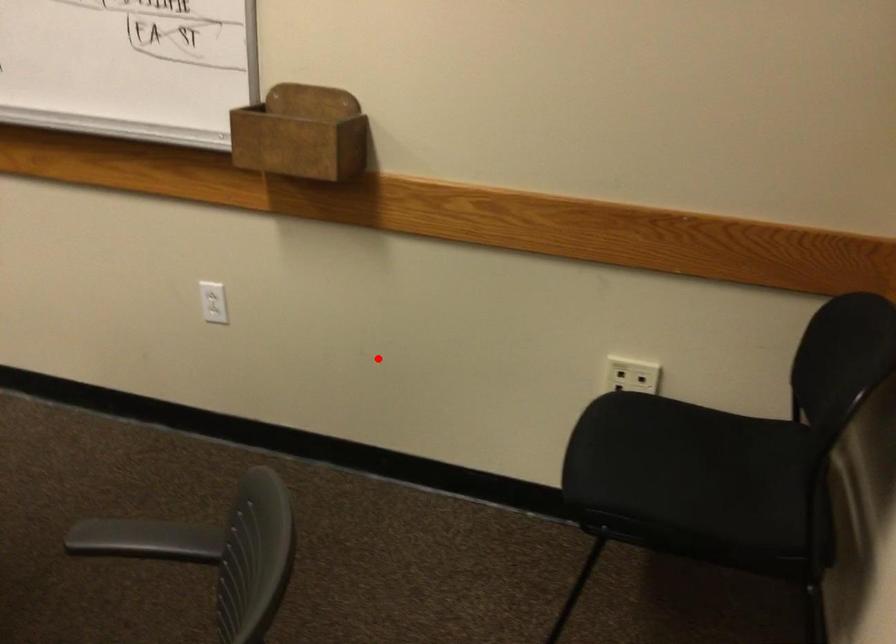
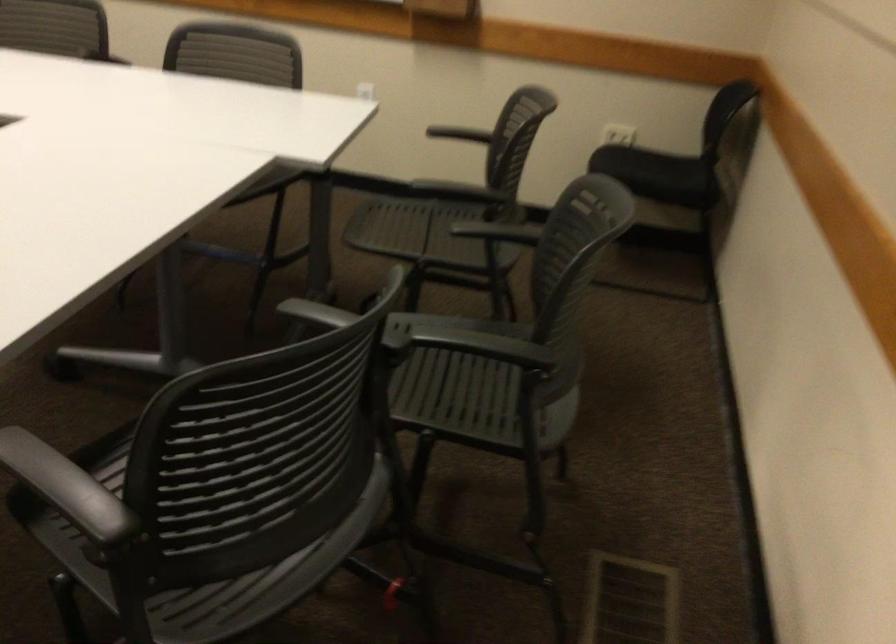
Question: I am providing you with two images of the same scene from different viewpoints. A red point is shown in image1. For the corresponding object point in image2, is it positioned nearer or farther from the camera?

Choices:
 (A) Nearer
 (B) Farther

Answer: (B)